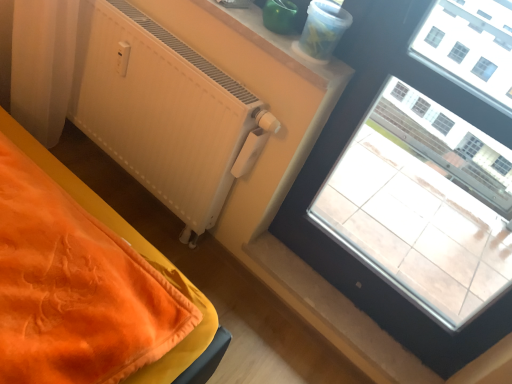
Question: From a real-world perspective, is transparent glass window at upper right located beneath white matte radiator at upper left?

Choices:
 (A) no
 (B) yes

Answer: (A)

Question: Can white matte radiator at upper left be found inside transparent glass window at upper right?

Choices:
 (A) yes
 (B) no

Answer: (B)

Question: Can you confirm if transparent glass window at upper right is shorter than white matte radiator at upper left?

Choices:
 (A) no
 (B) yes

Answer: (A)

Question: Does transparent glass window at upper right come behind white matte radiator at upper left?

Choices:
 (A) no
 (B) yes

Answer: (A)

Question: From a real-world perspective, is transparent glass window at upper right on white matte radiator at upper left?

Choices:
 (A) no
 (B) yes

Answer: (B)

Question: Can you confirm if transparent glass window at upper right is positioned to the right of white matte radiator at upper left?

Choices:
 (A) yes
 (B) no

Answer: (A)

Question: Is white matte radiator at upper left positioned before smooth plastic container at upper center?

Choices:
 (A) no
 (B) yes

Answer: (A)

Question: From the image's perspective, is white matte radiator at upper left on smooth plastic container at upper center?

Choices:
 (A) yes
 (B) no

Answer: (B)

Question: Is white matte radiator at upper left thinner than smooth plastic container at upper center?

Choices:
 (A) no
 (B) yes

Answer: (B)

Question: Would you say white matte radiator at upper left contains smooth plastic container at upper center?

Choices:
 (A) no
 (B) yes

Answer: (A)

Question: Is white matte radiator at upper left outside smooth plastic container at upper center?

Choices:
 (A) yes
 (B) no

Answer: (A)

Question: From the image's perspective, is white matte radiator at upper left below smooth plastic container at upper center?

Choices:
 (A) yes
 (B) no

Answer: (A)

Question: From the image's perspective, is smooth plastic container at upper center beneath transparent glass window at upper right?

Choices:
 (A) no
 (B) yes

Answer: (A)